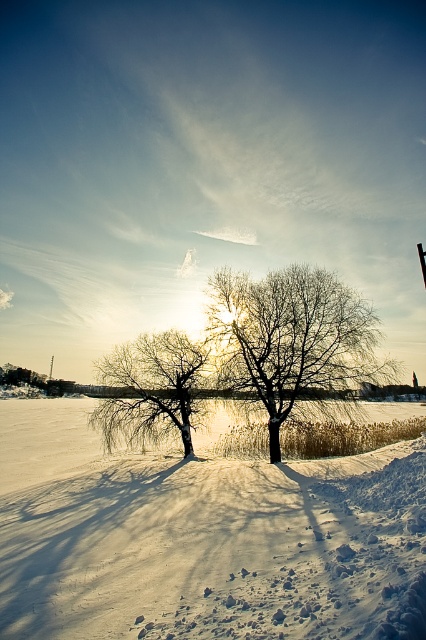
Based on the photo, you are an artist trying to paint the winter landscape. You want to ensure the white powdery snow at center and the bare wood tree at center are proportionally accurate. Which object should you paint larger in your artwork?

The white powdery snow at center should be painted larger than the bare wood tree at center because it has a larger size compared to the tree according to the description.

You are standing at point A and want to walk to the nearest tree. Which direction should you head? The coordinates of point A are given as point A is at point (x=290, y=337). The scene has a bare wood tree at center. Please choose between north, south, east, or west.

The nearest tree is the bare wood tree at center located at point (x=290, y=337), so you are already at the location of the tree. Therefore, you don not need to move in any direction.